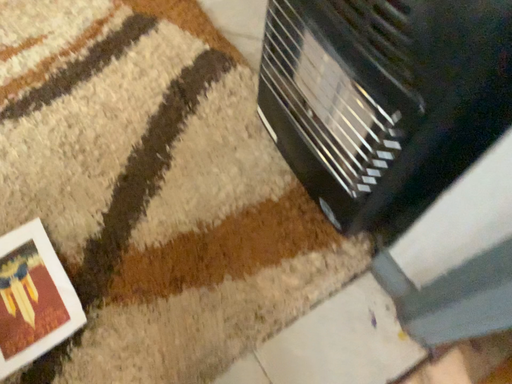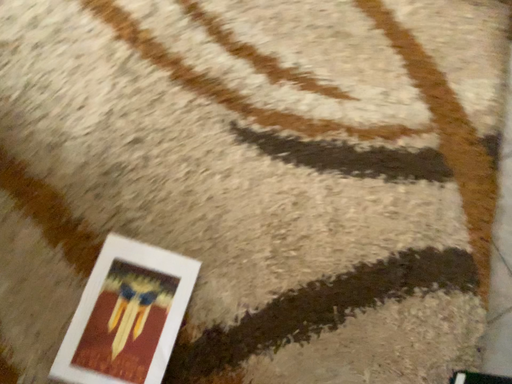
Question: Which way did the camera rotate in the video?

Choices:
 (A) rotated right
 (B) rotated left

Answer: (B)